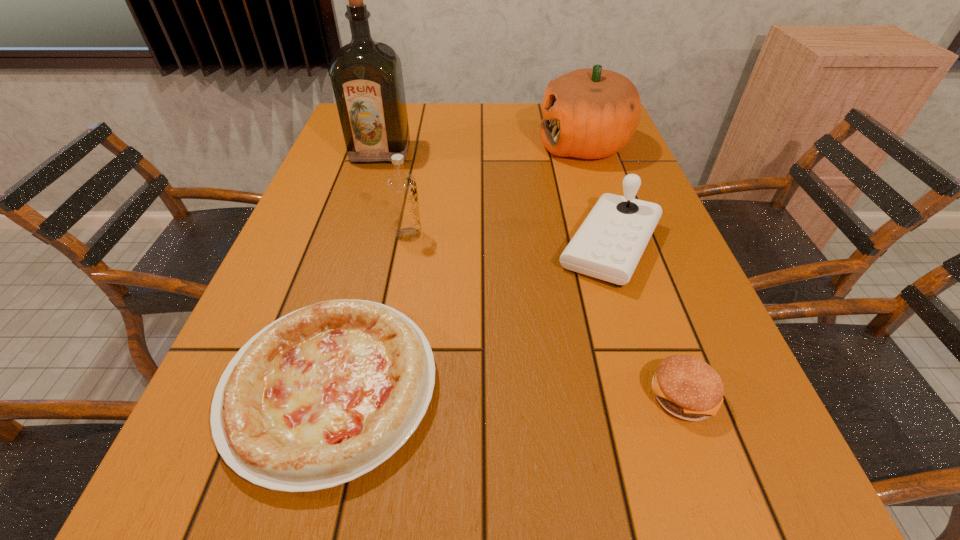
The height and width of the screenshot is (540, 960). I want to click on free region that satisfies the following two spatial constraints: 1. on the front label of the third shortest object; 2. on the left side of the vodka, so (406, 246).

In order to click on free space that satisfies the following two spatial constraints: 1. on the front label of the vodka; 2. on the left side of the third shortest object in this screenshot , I will do `click(406, 246)`.

You are a GUI agent. You are given a task and a screenshot of the screen. Output one action in this format:
    pyautogui.click(x=<x>, y=<y>)
    Task: Click on the free spot that satisfies the following two spatial constraints: 1. on the label of the liquor; 2. on the right side of the pizza
    The width and height of the screenshot is (960, 540).
    Given the screenshot: What is the action you would take?
    pyautogui.click(x=308, y=387)

This screenshot has width=960, height=540. Find the location of `free space that satisfies the following two spatial constraints: 1. on the label of the pizza; 2. on the left side of the tallest object`. free space that satisfies the following two spatial constraints: 1. on the label of the pizza; 2. on the left side of the tallest object is located at coordinates (308, 387).

Find the location of `vacant area in the image that satisfies the following two spatial constraints: 1. on the label of the third shortest object; 2. on the left side of the liquor`. vacant area in the image that satisfies the following two spatial constraints: 1. on the label of the third shortest object; 2. on the left side of the liquor is located at coordinates (352, 246).